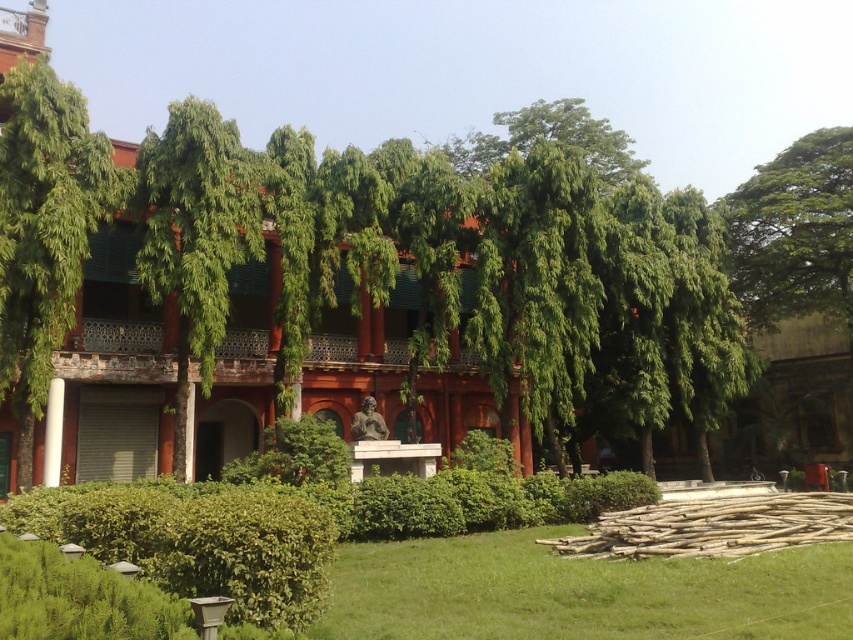
Question: Which object appears closest to the camera in this image?

Choices:
 (A) green leafy hedge at lower left
 (B) green leafy tree at upper right
 (C) green grass at lower center

Answer: (A)

Question: Does green grass at lower center have a smaller size compared to green leafy tree at upper right?

Choices:
 (A) yes
 (B) no

Answer: (A)

Question: Which point is closer to the camera?

Choices:
 (A) green leafy tree at left
 (B) green leafy tree at upper right
 (C) green leafy tree at center

Answer: (A)

Question: Does green leafy hedge at lower left have a larger size compared to green leafy tree at left?

Choices:
 (A) no
 (B) yes

Answer: (A)

Question: Observing the image, what is the correct spatial positioning of green leafy tree at left in reference to green leafy tree at center?

Choices:
 (A) left
 (B) right

Answer: (A)

Question: Estimate the real-world distances between objects in this image. Which object is farther from the green grass at lower center?

Choices:
 (A) green leafy tree at left
 (B) green leafy hedge at lower left
 (C) green leafy tree at center
 (D) green leafy tree at upper right

Answer: (D)